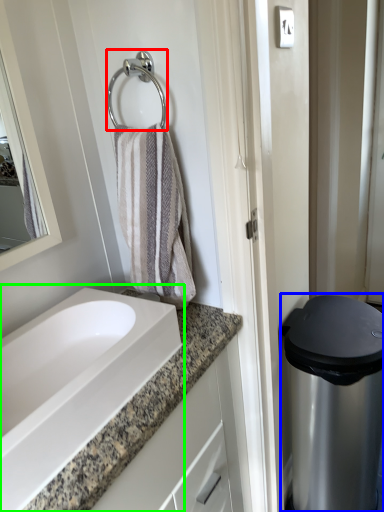
Question: Which is farther away from shower (highlighted by a red box)? appliance (highlighted by a blue box) or sink (highlighted by a green box)?

Choices:
 (A) appliance
 (B) sink

Answer: (A)